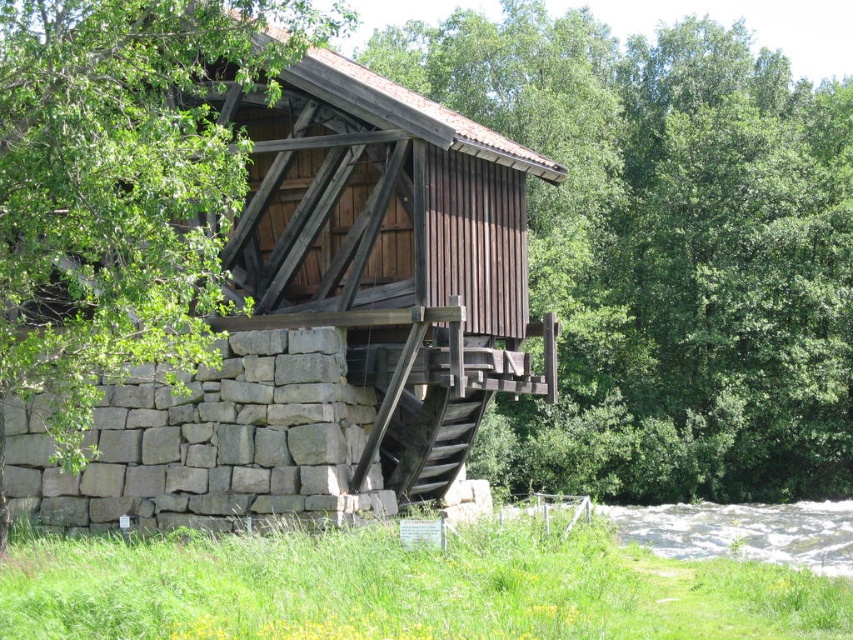
Consider the image. You are standing at the center of the image and want to find the brown wood tree at center. According to the coordinates provided, in which direction should you look to locate it?

The brown wood tree at center is located at coordinates point (665, 252), which is slightly to the lower right from the exact center. So you should look towards the lower right direction to find it.

You are standing at the entrance of the watermill and want to cross to the other side of the white frothy water at lower right. The brown wood tree at center is blocking your path. Can you walk around the tree to reach the water?

The brown wood tree at center is further to the viewer than white frothy water at lower right. Since the tree is closer to you, you can walk around it to access the white frothy water at lower right.

You are standing at the point closest to the viewer in the image. Which point, point (706, 109) or point (132, 444), is farther away from you?

Point (706, 109) is farther away from you because it is behind point (132, 444).